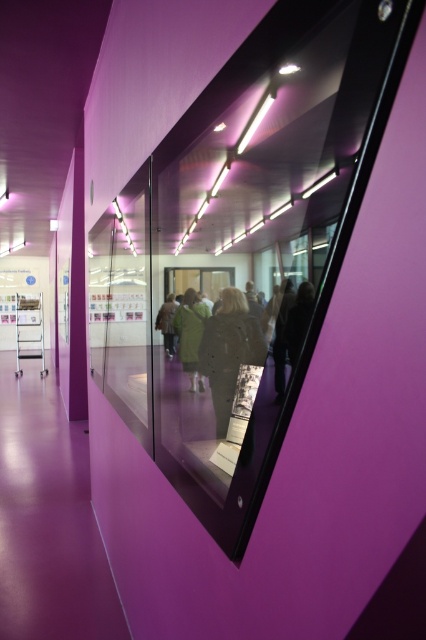
Question: Is dark gray fabric coat at center positioned before dark gray textured coat at center?

Choices:
 (A) yes
 (B) no

Answer: (A)

Question: Is dark gray fabric coat at center positioned behind dark gray textured coat at center?

Choices:
 (A) yes
 (B) no

Answer: (B)

Question: Based on their relative distances, which object is farther from the dark gray fabric coat at center?

Choices:
 (A) green fabric coat at center
 (B) green fabric jacket at center
 (C) dark gray textured coat at center

Answer: (B)

Question: Which object is the closest to the dark gray textured coat at center?

Choices:
 (A) green fabric coat at center
 (B) green fabric jacket at center
 (C) dark gray fabric coat at center

Answer: (C)

Question: Which of the following is the closest to the observer?

Choices:
 (A) (169, 323)
 (B) (233, 358)

Answer: (B)

Question: Is dark gray textured coat at center below green fabric jacket at center?

Choices:
 (A) yes
 (B) no

Answer: (A)